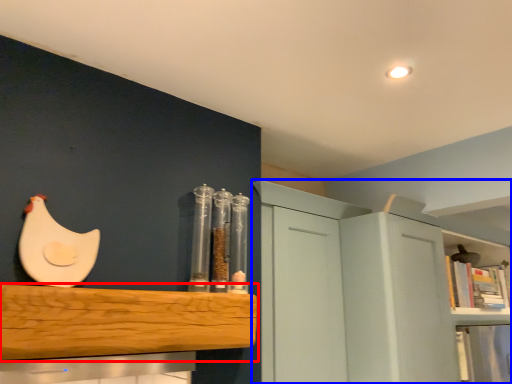
Question: Which of the following is the farthest to the observer, shelf (highlighted by a red box) or cabinetry (highlighted by a blue box)?

Choices:
 (A) shelf
 (B) cabinetry

Answer: (B)